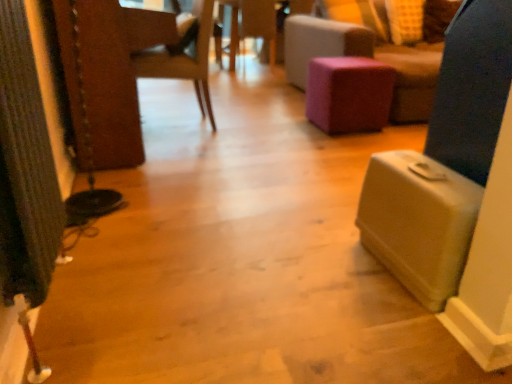
The height and width of the screenshot is (384, 512). What do you see at coordinates (183, 60) in the screenshot?
I see `wooden chair at center` at bounding box center [183, 60].

Describe the element at coordinates (252, 25) in the screenshot. The width and height of the screenshot is (512, 384). I see `wooden side table at center` at that location.

Where is `beige plastic suitcase at lower right`? The height and width of the screenshot is (384, 512). beige plastic suitcase at lower right is located at coordinates (418, 222).

Is point (161, 75) in front of point (411, 57)?

Yes, point (161, 75) is in front of point (411, 57).

Between wooden chair at center and purple fabric ottoman at center, which one is positioned in front?

Positioned in front is wooden chair at center.

From the picture: Considering the relative sizes of wooden chair at center and purple fabric ottoman at center in the image provided, is wooden chair at center shorter than purple fabric ottoman at center?

No, wooden chair at center is not shorter than purple fabric ottoman at center.

Looking at this image, from a real-world perspective, between wooden side table at center and purple fabric stool at center, who is vertically lower?

purple fabric stool at center.

Does wooden side table at center have a lesser height compared to purple fabric stool at center?

Incorrect, the height of wooden side table at center does not fall short of that of purple fabric stool at center.

Could purple fabric stool at center be considered to be inside wooden side table at center?

No, purple fabric stool at center is not a part of wooden side table at center.

From the image's perspective, is wooden side table at center on purple fabric stool at center?

Yes, from the image's perspective, wooden side table at center is above purple fabric stool at center.

From a real-world perspective, which is physically below, purple fabric stool at center or purple fabric ottoman at center?

In real-world perspective, purple fabric stool at center is lower.

Can you confirm if purple fabric stool at center is thinner than purple fabric ottoman at center?

Correct, the width of purple fabric stool at center is less than that of purple fabric ottoman at center.

Can you tell me how much purple fabric stool at center and purple fabric ottoman at center differ in facing direction?

The angular difference between purple fabric stool at center and purple fabric ottoman at center is 87.5 degrees.

In the scene shown: Is purple fabric stool at center facing away from purple fabric ottoman at center?

No, purple fabric stool at center's orientation is not away from purple fabric ottoman at center.

From the image's perspective, does beige plastic suitcase at lower right appear higher than wooden side table at center?

Actually, beige plastic suitcase at lower right appears below wooden side table at center in the image.

Is point (372, 191) positioned behind point (227, 2)?

No, (372, 191) is closer to viewer.

Which object is more forward, beige plastic suitcase at lower right or wooden side table at center?

beige plastic suitcase at lower right.

Is beige plastic suitcase at lower right positioned beyond the bounds of wooden side table at center?

Indeed, beige plastic suitcase at lower right is completely outside wooden side table at center.

Is point (172, 77) closer or farther from the camera than point (233, 60)?

Point (172, 77) is positioned closer to the camera compared to point (233, 60).

Considering the relative sizes of wooden chair at center and wooden side table at center in the image provided, is wooden chair at center smaller than wooden side table at center?

No.

From the image's perspective, is wooden chair at center above or below wooden side table at center?

Clearly, from the image's perspective, wooden chair at center is below wooden side table at center.

What are the coordinates of `chair in front of the wooden side table at center` in the screenshot? It's located at (183, 60).

Which is closer to the camera, (370, 238) or (361, 120)?

Point (370, 238) is closer to the camera than point (361, 120).

From the image's perspective, is beige plastic suitcase at lower right on top of purple fabric stool at center?

No, from the image's perspective, beige plastic suitcase at lower right is not over purple fabric stool at center.

What's the angular difference between beige plastic suitcase at lower right and purple fabric stool at center's facing directions?

91.5 degrees separate the facing orientations of beige plastic suitcase at lower right and purple fabric stool at center.

From a real-world perspective, is purple fabric ottoman at center under wooden side table at center?

No, from a real-world perspective, purple fabric ottoman at center is not beneath wooden side table at center.

Which is in front, point (425, 116) or point (240, 33)?

The point (425, 116) is in front.

Is purple fabric ottoman at center positioned beyond the bounds of wooden side table at center?

purple fabric ottoman at center lies outside wooden side table at center's area.

Can you tell me how much purple fabric ottoman at center and wooden side table at center differ in facing direction?

169 degrees.

In order to click on chair below the purple fabric ottoman at center (from the image's perspective) in this screenshot , I will do `click(183, 60)`.

The image size is (512, 384). Identify the location of side table on the left of purple fabric stool at center. (252, 25).

Which object lies nearer to the anchor point purple fabric ottoman at center, beige plastic suitcase at lower right or purple fabric stool at center?

Based on the image, purple fabric stool at center appears to be nearer to purple fabric ottoman at center.

Estimate the real-world distances between objects in this image. Which object is further from beige plastic suitcase at lower right, purple fabric stool at center or wooden side table at center?

wooden side table at center.

Consider the image. From the image, which object appears to be farther from beige plastic suitcase at lower right, wooden chair at center or purple fabric ottoman at center?

purple fabric ottoman at center is further to beige plastic suitcase at lower right.

In the scene shown: From the image, which object appears to be nearer to wooden chair at center, purple fabric ottoman at center or purple fabric stool at center?

purple fabric stool at center lies closer to wooden chair at center than the other object.

From the image, which object appears to be farther from purple fabric ottoman at center, wooden chair at center or purple fabric stool at center?

Among the two, wooden chair at center is located further to purple fabric ottoman at center.

From the image, which object appears to be nearer to purple fabric stool at center, wooden chair at center or purple fabric ottoman at center?

Based on the image, purple fabric ottoman at center appears to be nearer to purple fabric stool at center.

Which object lies further to the anchor point purple fabric ottoman at center, beige plastic suitcase at lower right or wooden chair at center?

The object further to purple fabric ottoman at center is beige plastic suitcase at lower right.

Based on their spatial positions, is purple fabric stool at center or beige plastic suitcase at lower right closer to wooden chair at center?

The object closer to wooden chair at center is purple fabric stool at center.

Identify the location of furniture between beige plastic suitcase at lower right and wooden side table at center from front to back. The height and width of the screenshot is (384, 512). (366, 56).

The image size is (512, 384). Identify the location of chair between beige plastic suitcase at lower right and wooden side table at center in the front-back direction. click(x=183, y=60).

Find the location of `furniture between wooden chair at center and wooden side table at center in the front-back direction`. furniture between wooden chair at center and wooden side table at center in the front-back direction is located at coordinates (366, 56).

Find the location of a particular element. stool located between wooden chair at center and purple fabric ottoman at center in the left-right direction is located at coordinates (349, 94).